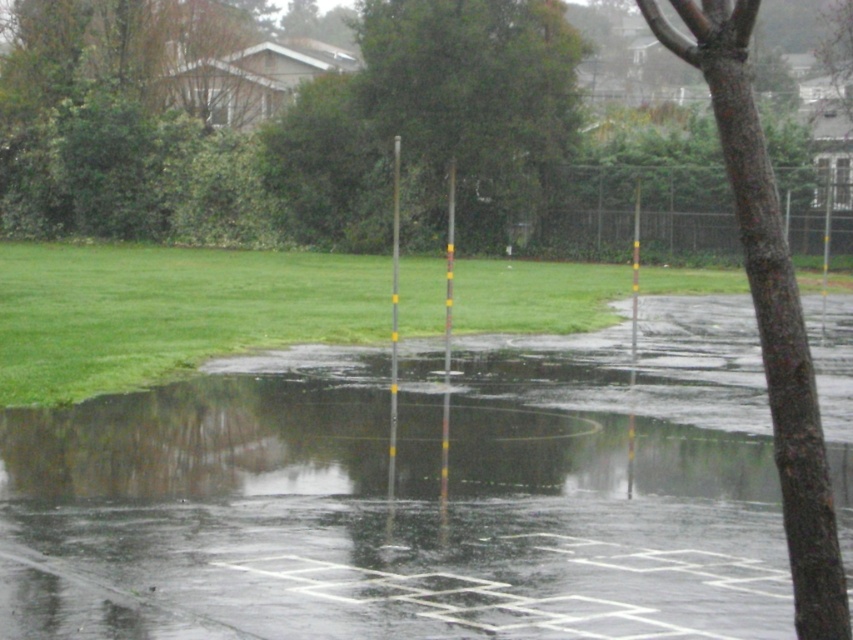
Question: Does green leafy tree at upper center appear under yellow plastic pole at right?

Choices:
 (A) yes
 (B) no

Answer: (B)

Question: Which object is the farthest from the green leafy tree at upper center?

Choices:
 (A) yellow plastic pole at right
 (B) brown textured tree at upper right
 (C) yellow painted metal pole at center
 (D) brown rough bark tree at right

Answer: (D)

Question: Can you confirm if transparent wet pavement at center is thinner than brown textured tree at upper right?

Choices:
 (A) no
 (B) yes

Answer: (B)

Question: Among these objects, which one is nearest to the camera?

Choices:
 (A) green leafy tree at upper center
 (B) brown rough bark tree at right
 (C) transparent wet pavement at center

Answer: (B)

Question: Which object is closer to the camera taking this photo?

Choices:
 (A) green leafy tree at upper center
 (B) yellow plastic pole at right
 (C) yellow painted metal pole at center

Answer: (C)

Question: Can you confirm if transparent wet pavement at center is positioned above brown rough bark tree at right?

Choices:
 (A) no
 (B) yes

Answer: (A)